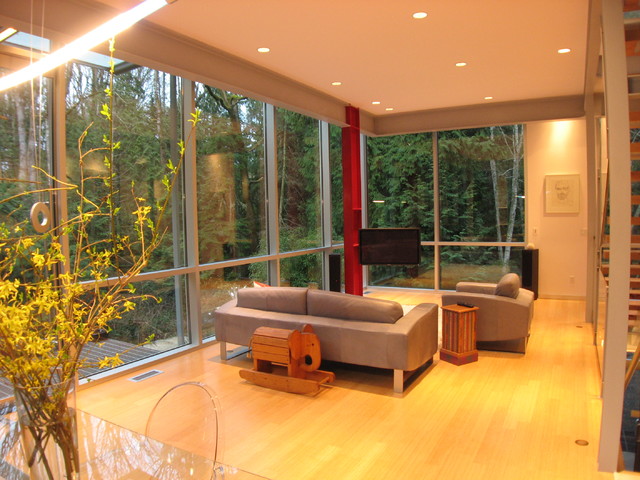
What are the coordinates of `wood floor` in the screenshot? It's located at coord(397,423).